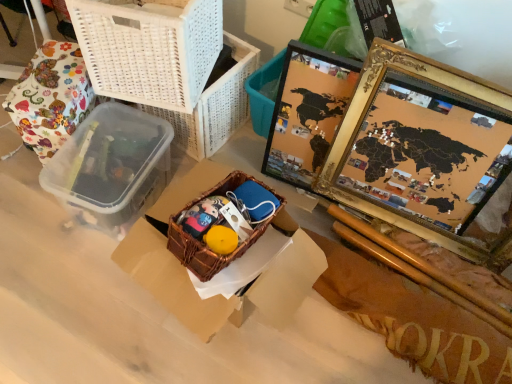
Question: In terms of width, does brown woven basket at center look wider or thinner when compared to woven brown basket at center?

Choices:
 (A) wide
 (B) thin

Answer: (A)

Question: In the image, is brown woven basket at center positioned in front of or behind woven brown basket at center?

Choices:
 (A) behind
 (B) front

Answer: (B)

Question: Which of these objects is positioned closest to the white woven basket at upper left?

Choices:
 (A) floral fabric wrapped object at left
 (B) transparent plastic lunch box at left
 (C) gold-framed map at right
 (D) brown woven basket at center
 (E) woven brown basket at center

Answer: (A)

Question: Estimate the real-world distances between objects in this image. Which object is closer to the brown woven basket at center?

Choices:
 (A) white woven basket at upper left
 (B) floral fabric wrapped object at left
 (C) gold-framed map at right
 (D) transparent plastic lunch box at left
 (E) woven brown basket at center

Answer: (E)